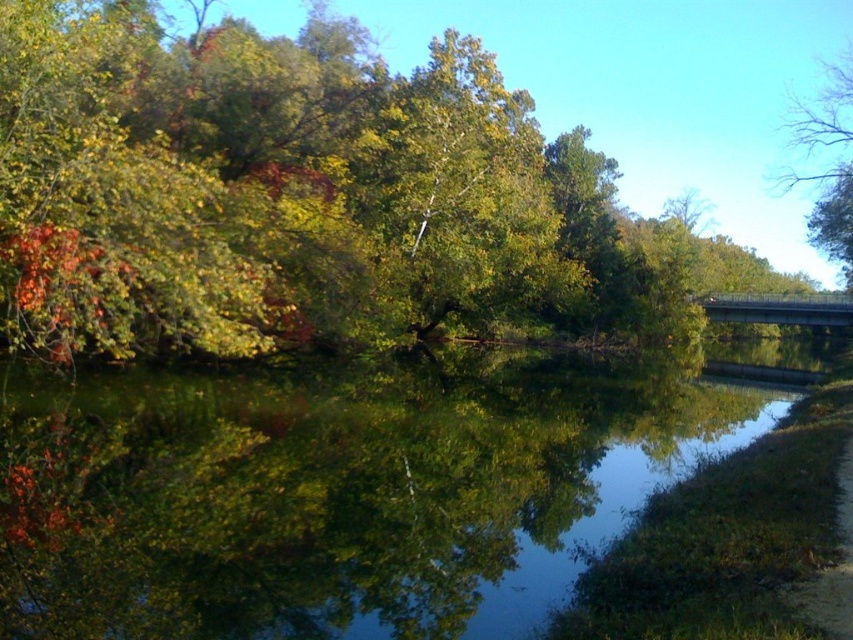
Identify the location of green leafy tree at upper center. This screenshot has width=853, height=640. (289, 193).

Is green leafy tree at upper center positioned behind bare branches at upper right?

No, it is not.

I want to click on green leafy tree at upper center, so click(289, 193).

Is green leafy tree at upper center below green reflective water at center?

Actually, green leafy tree at upper center is above green reflective water at center.

Does green leafy tree at upper center have a lesser width compared to green reflective water at center?

No.

Is point (221, 42) more distant than point (74, 529)?

That is True.

Where is `green leafy tree at upper center`? This screenshot has width=853, height=640. green leafy tree at upper center is located at coordinates (289, 193).

Does green reflective water at center have a smaller size compared to bare branches at upper right?

Indeed, green reflective water at center has a smaller size compared to bare branches at upper right.

Does green reflective water at center appear over bare branches at upper right?

No, green reflective water at center is not above bare branches at upper right.

Between point (129, 627) and point (817, 198), which one is positioned behind?

The point (817, 198) is more distant.

Where is `green reflective water at center`? This screenshot has height=640, width=853. green reflective water at center is located at coordinates (347, 488).